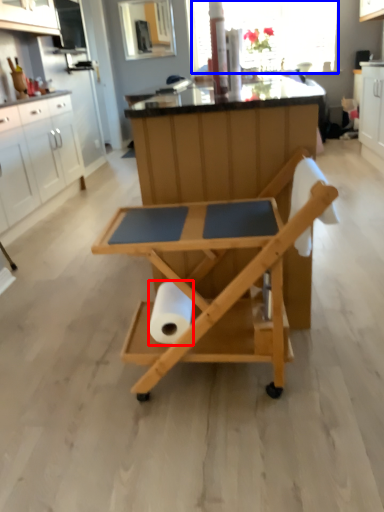
Question: Which object is closer to the camera taking this photo, paper towel (highlighted by a red box) or window screen (highlighted by a blue box)?

Choices:
 (A) paper towel
 (B) window screen

Answer: (A)